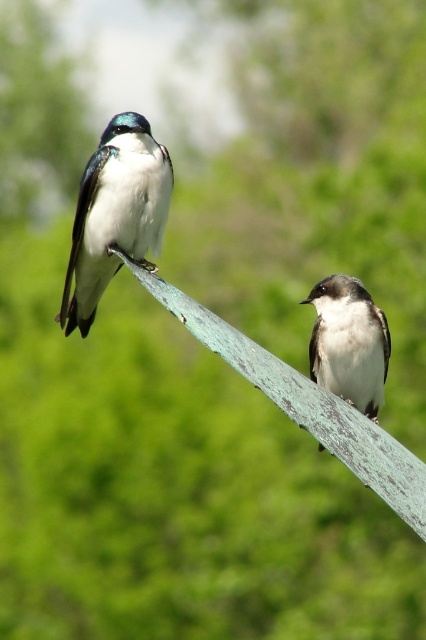
Is shiny white bird at upper left closer to the viewer compared to white matte bird at center?

Yes, shiny white bird at upper left is in front of white matte bird at center.

Who is more forward, (97, 275) or (374, 368)?

Point (97, 275) is more forward.

You are a GUI agent. You are given a task and a screenshot of the screen. Output one action in this format:
    pyautogui.click(x=<x>, y=<y>)
    Task: Click on the shiny white bird at upper left
    
    Given the screenshot: What is the action you would take?
    pyautogui.click(x=115, y=212)

Locate an element on the screen. The width and height of the screenshot is (426, 640). shiny white bird at upper left is located at coordinates (115, 212).